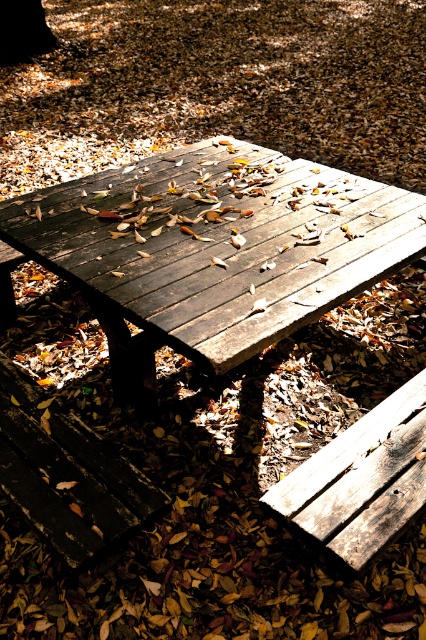
You are a person standing at the edge of the park and want to sit down. You see the dark brown wood picnic table at center and the wooden bench at lower right. Which one is closer to you?

The dark brown wood picnic table at center is closer to you than the wooden bench at lower right because it is further to the viewer.

You are sitting at the picnic table and want to move to the wooden bench at lower right. Can you easily walk around the dark brown wood bench at lower left to reach it?

The wooden bench at lower right is behind the dark brown wood bench at lower left, so you would need to walk around the dark brown wood bench at lower left to reach it. Since the benches are positioned with one behind the other, there should be enough space to maneuver around the dark brown wood bench at lower left to get to the wooden bench at lower right.

You are sitting at the dark brown wood picnic table at center and want to look at the smooth dark brown tree trunk at upper left. Which direction should you turn your head to see it?

The dark brown wood picnic table at center is in front of the smooth dark brown tree trunk at upper left, so you should turn your head upward and to the left to see it.